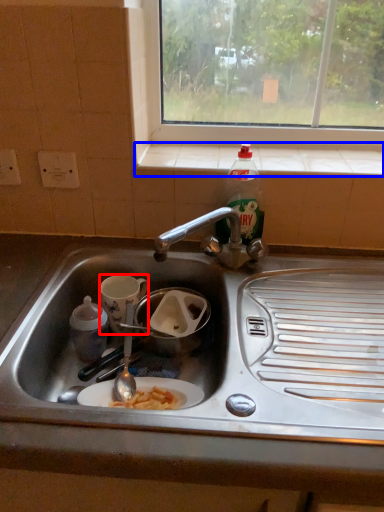
Question: Which object is further to the camera taking this photo, coffee cup (highlighted by a red box) or window sill (highlighted by a blue box)?

Choices:
 (A) coffee cup
 (B) window sill

Answer: (B)